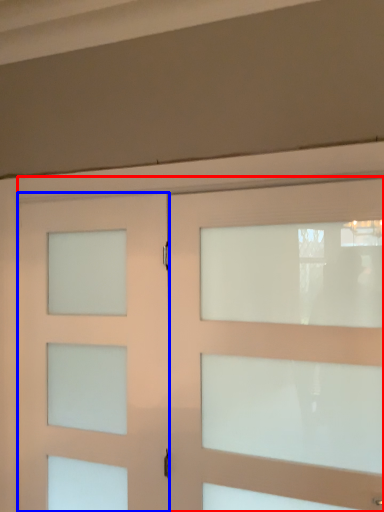
Question: Which point is closer to the camera, door (highlighted by a red box) or door (highlighted by a blue box)?

Choices:
 (A) door
 (B) door

Answer: (A)